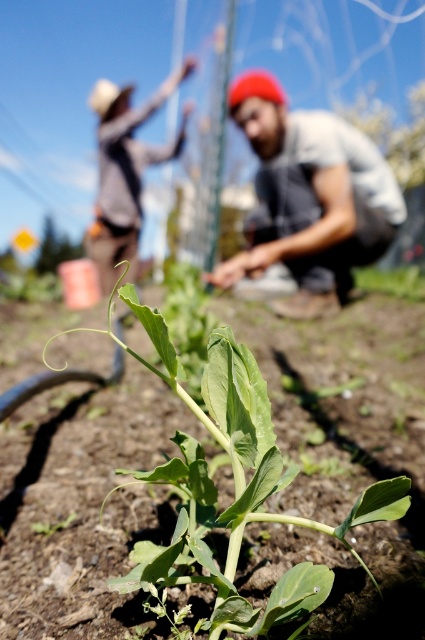
Measure the distance between green leafy plant at center and gray fabric shirt at center.

The distance of green leafy plant at center from gray fabric shirt at center is 4.35 meters.

Does green leafy plant at center have a greater height compared to gray fabric shirt at center?

No.

The image size is (425, 640). Describe the element at coordinates (234, 488) in the screenshot. I see `green leafy plant at center` at that location.

Where is `green leafy plant at center`? The height and width of the screenshot is (640, 425). green leafy plant at center is located at coordinates (234, 488).